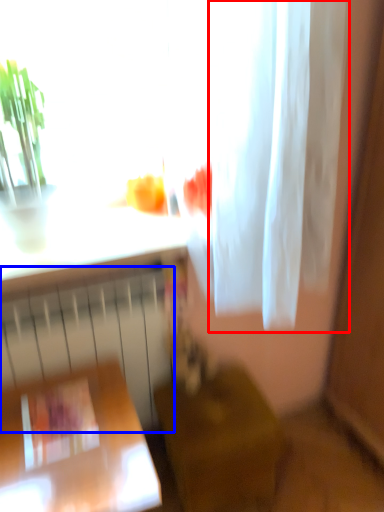
Question: Which point is closer to the camera, shower curtain (highlighted by a red box) or radiator (highlighted by a blue box)?

Choices:
 (A) shower curtain
 (B) radiator

Answer: (A)